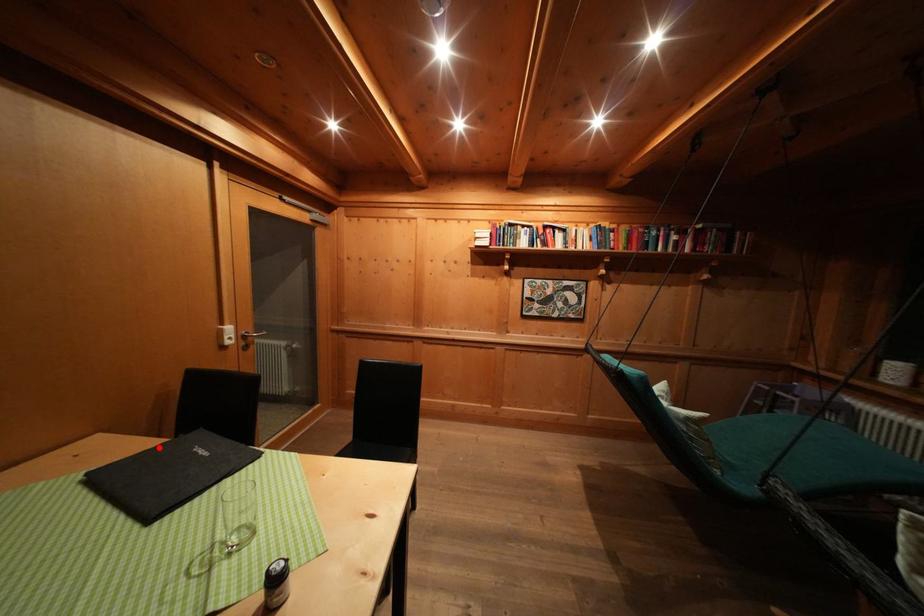
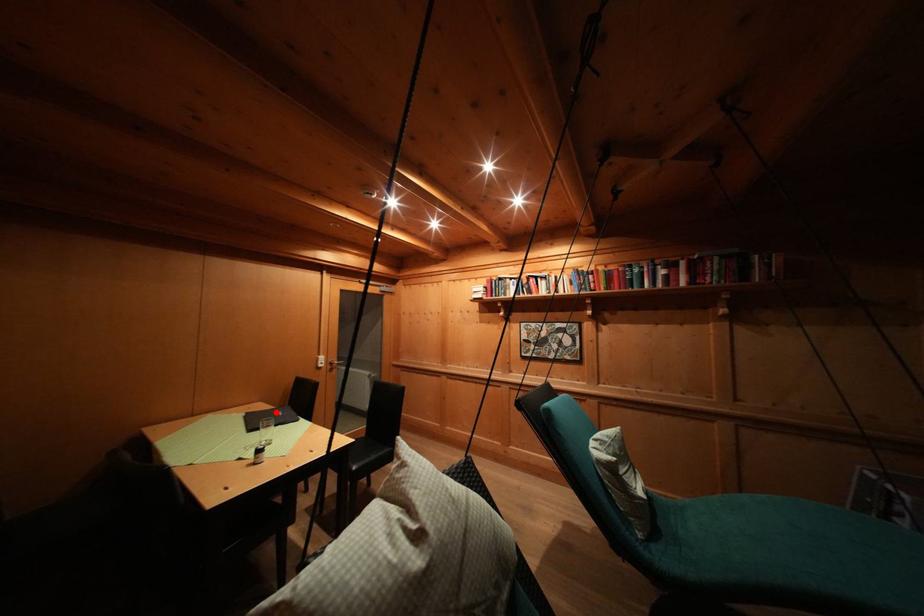
I am providing you with two images of the same scene from different viewpoints. A red point is marked on the first image and another point is marked on the second image. Do the highlighted points in image1 and image2 indicate the same real-world spot?

Yes